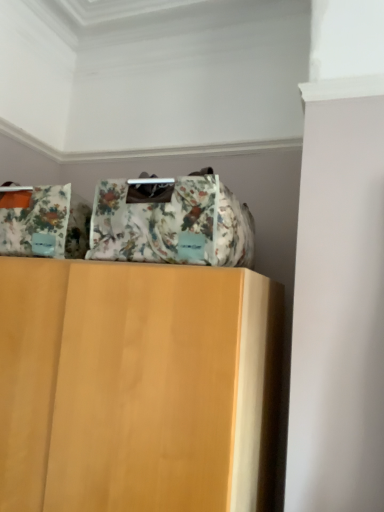
The width and height of the screenshot is (384, 512). Describe the element at coordinates (171, 222) in the screenshot. I see `floral fabric bag at center` at that location.

Measure the distance between floral fabric bag at center and camera.

floral fabric bag at center is 1.06 meters away from camera.

This screenshot has height=512, width=384. In order to click on floral fabric bag at center in this screenshot , I will do `click(171, 222)`.

Locate an element on the screen. The width and height of the screenshot is (384, 512). floral fabric bag at center is located at coordinates (171, 222).